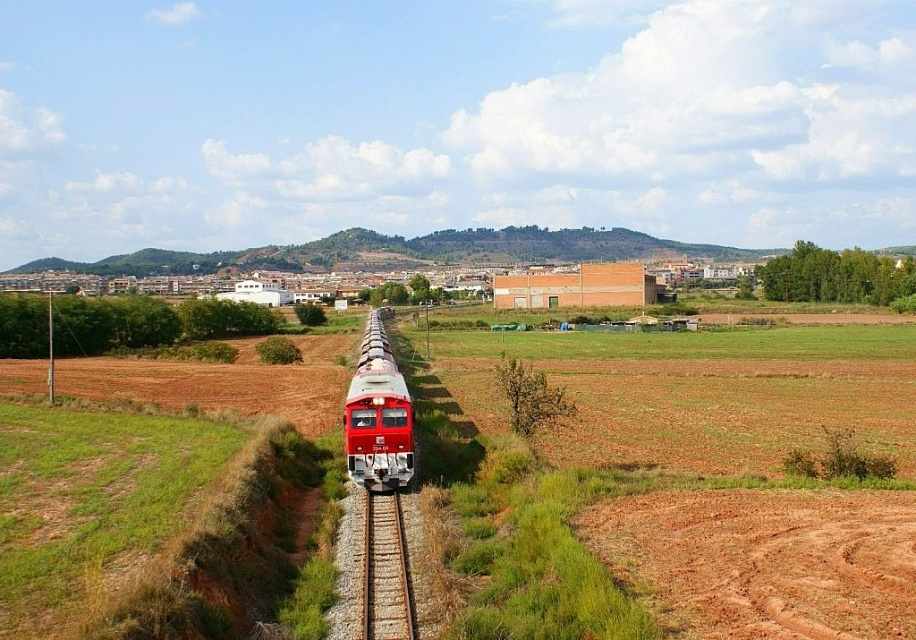
You are a photographer standing at the edge of the red clay dirt track at lower right, aiming to capture the matte red train at center as it passes by. Based on their relative heights, will the train be visible above the track from your position?

The red clay dirt track at lower right is not as tall as the matte red train at center, so the train will be visible above the track from your position.

You are a landscape architect planning to install a new drainage system. You need to know which of the two tracks, the red clay dirt track at lower right or the rusty metal train track at center, is higher in elevation to determine water flow direction. Which track is higher?

The red clay dirt track at lower right is taller than the rusty metal train track at center, so water would flow away from the red clay dirt track at lower right toward the lower rusty metal train track at center.

You are a farmer who needs to transport a large tractor across the landscape. You see the red clay dirt track at lower right and the rusty metal train track at center. Which path is wider and more suitable for your tractor?

The red clay dirt track at lower right is wider than the rusty metal train track at center, so it is more suitable for transporting a large tractor.